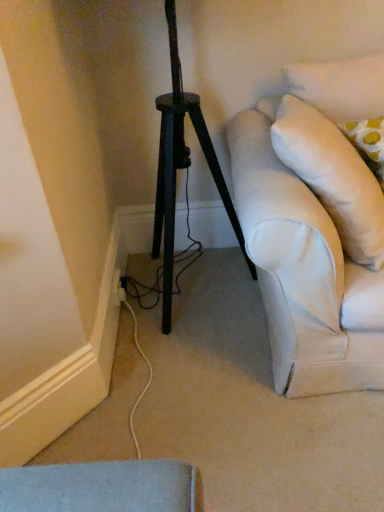
Question: Would you say white plastic electric outlet at lower left is inside or outside white soft pillow at right?

Choices:
 (A) outside
 (B) inside

Answer: (A)

Question: Considering the relative positions of white plastic electric outlet at lower left and white soft pillow at right in the image provided, is white plastic electric outlet at lower left to the left or to the right of white soft pillow at right?

Choices:
 (A) left
 (B) right

Answer: (A)

Question: From the image's perspective, is white plastic electric outlet at lower left located above or below white soft pillow at right?

Choices:
 (A) above
 (B) below

Answer: (B)

Question: Is white soft pillow at right wider or thinner than white plastic electric outlet at lower left?

Choices:
 (A) thin
 (B) wide

Answer: (B)

Question: Is point (339, 187) positioned closer to the camera than point (115, 294)?

Choices:
 (A) closer
 (B) farther

Answer: (A)

Question: In the image, is white soft pillow at right positioned in front of or behind white plastic electric outlet at lower left?

Choices:
 (A) front
 (B) behind

Answer: (A)

Question: Considering the positions of white soft pillow at right and white plastic electric outlet at lower left in the image, is white soft pillow at right bigger or smaller than white plastic electric outlet at lower left?

Choices:
 (A) small
 (B) big

Answer: (B)